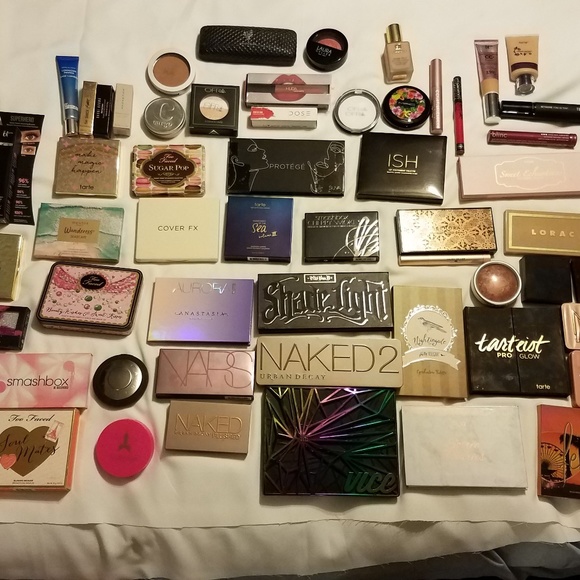
This screenshot has height=580, width=580. In order to click on sheet in this screenshot , I will do `click(209, 556)`.